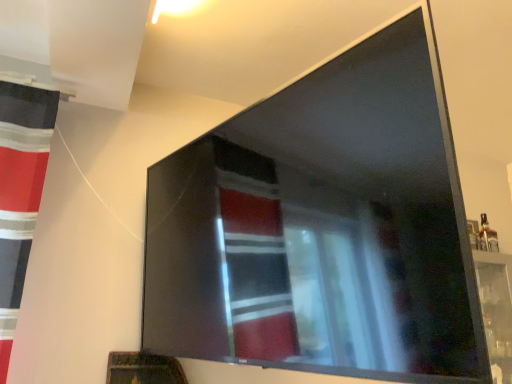
Looking at this image, measure the distance between point (489,231) and camera.

The depth of point (489,231) is 8.14 feet.

Find the location of a particular element. matte glass bottle at upper right is located at coordinates (487, 236).

Describe the element at coordinates (487, 236) in the screenshot. The image size is (512, 384). I see `matte glass bottle at upper right` at that location.

Identify the location of matte glass bottle at upper right. (487, 236).